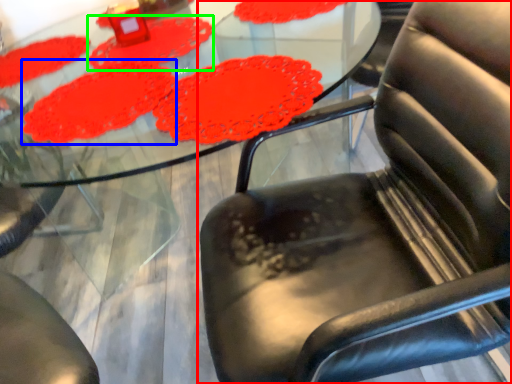
Question: Which is nearer to the chair (highlighted by a red box)? mat (highlighted by a blue box) or mat (highlighted by a green box).

Choices:
 (A) mat
 (B) mat

Answer: (A)